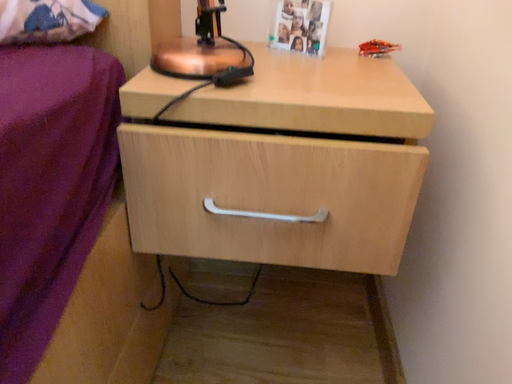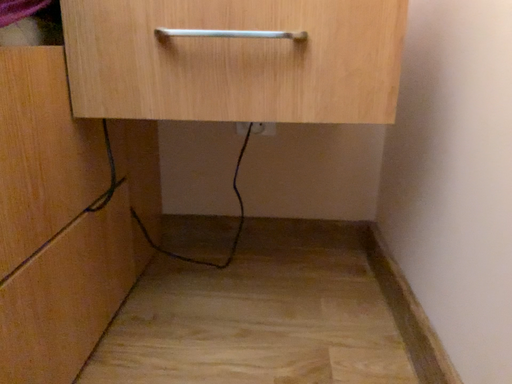
Question: How did the camera likely rotate when shooting the video?

Choices:
 (A) rotated upward
 (B) rotated downward

Answer: (A)